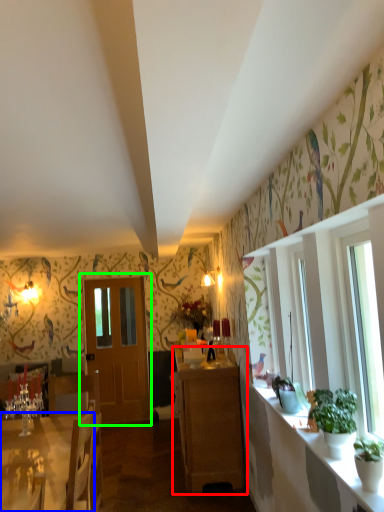
Question: Considering the real-world distances, which object is farthest from cabinetry (highlighted by a red box)? desk (highlighted by a blue box) or door (highlighted by a green box)?

Choices:
 (A) desk
 (B) door

Answer: (B)